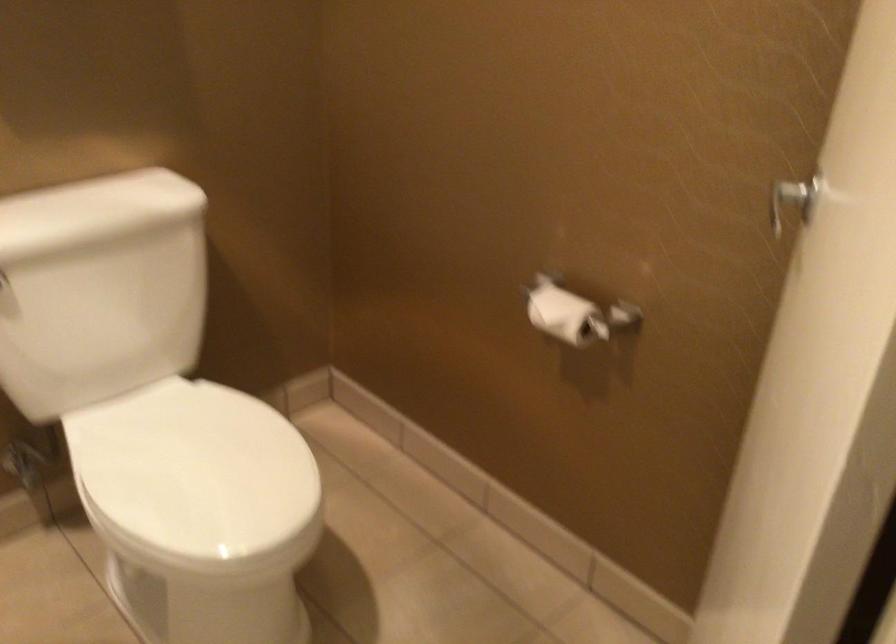
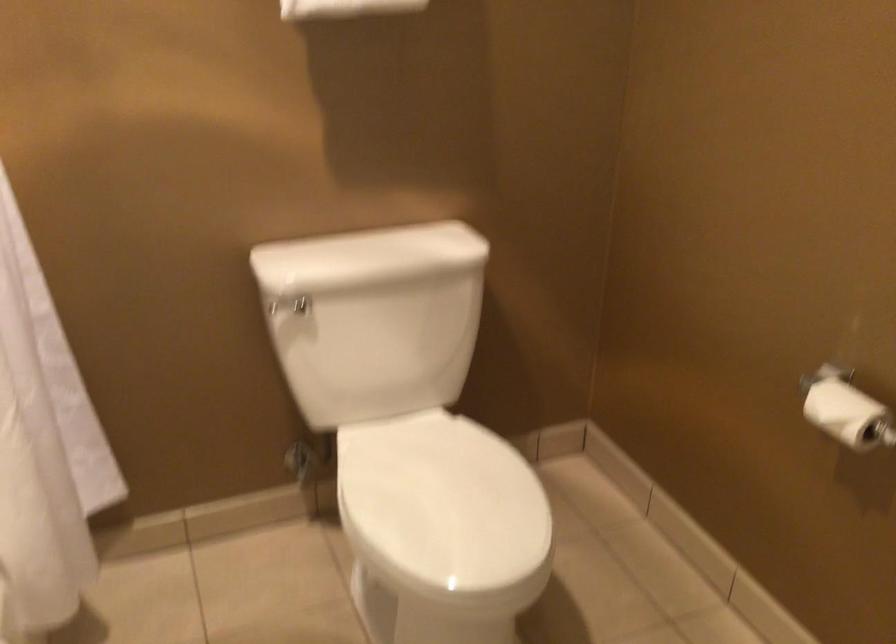
Question: The first image is from the beginning of the video and the second image is from the end. How did the camera likely rotate when shooting the video?

Choices:
 (A) Left
 (B) Right
 (C) Up
 (D) Down

Answer: (A)